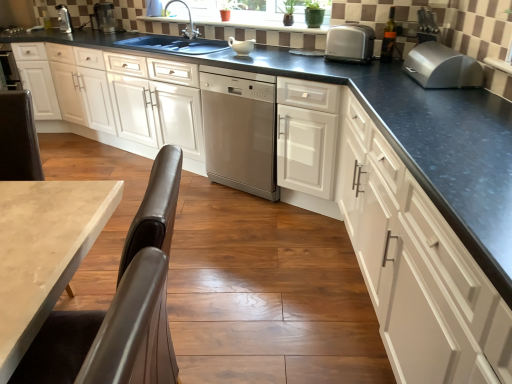
This screenshot has width=512, height=384. What are the coordinates of `free region on the left part of metal toaster at upper left, acting as the first appliance starting from the left` in the screenshot? It's located at point(48,35).